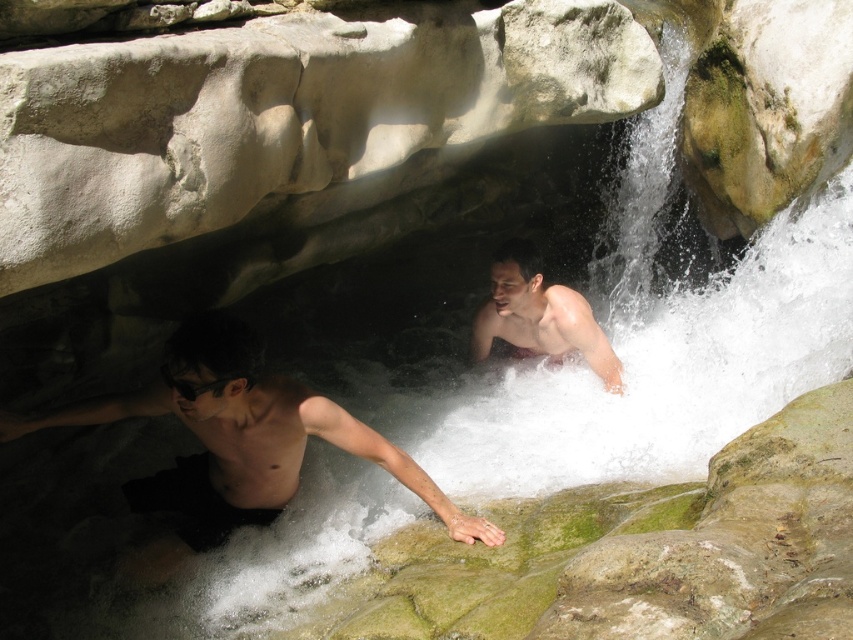
You are a photographer positioned at the cave entrance. You want to capture a photo that includes both the dark skin man at left and the smooth skin man at center. Based on their positions, which direction should you move to ensure both are in frame?

Since the dark skin man at left is located below the smooth skin man at center, you should move to the left or lower your angle to include both in the frame.

You are a photographer trying to capture a photo of the two men in the cave. You want to ensure both are visible in the frame. Since the dark skin man at left is on the left side of the smooth skin man at center, where should you position yourself relative to them to include both in the shot?

To include both the dark skin man at left and the smooth skin man at center in the frame, you should position yourself to the right side of the smooth skin man at center. This way, both men will be visible with the dark skin man at left on the left and the smooth skin man at center in the middle of the frame.

From the picture: You are a photographer positioned outside the cave and want to take a photo of both the dark skin man at left and the smooth skin man at center. Which person will appear larger in the photo?

The dark skin man at left will appear larger in the photo because he is closer to the viewer than the smooth skin man at center.